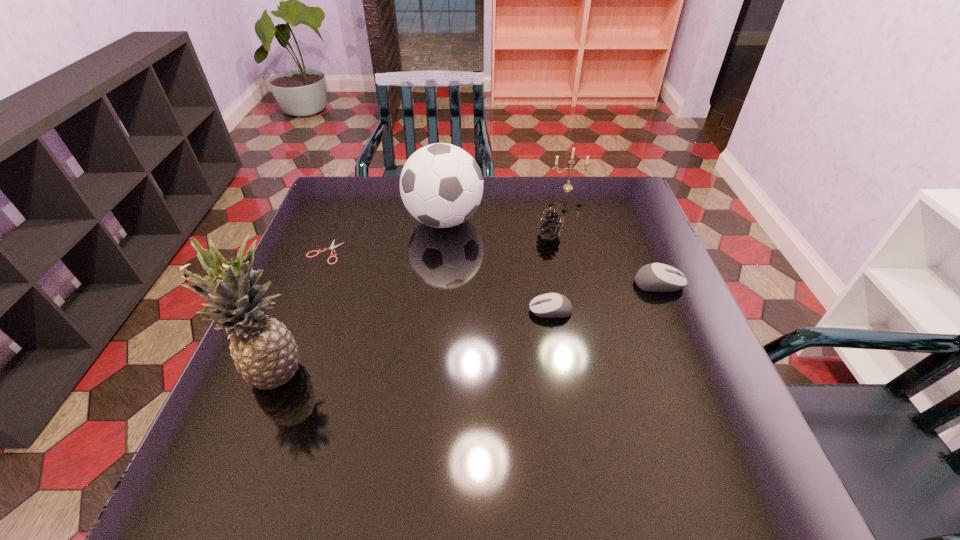
Please point a free position for a computer equipment on the left. Please provide its 2D coordinates. Your answer should be formatted as a tuple, i.e. [(x, y)], where the tuple contains the x and y coordinates of a point satisfying the conditions above.

[(426, 341)]